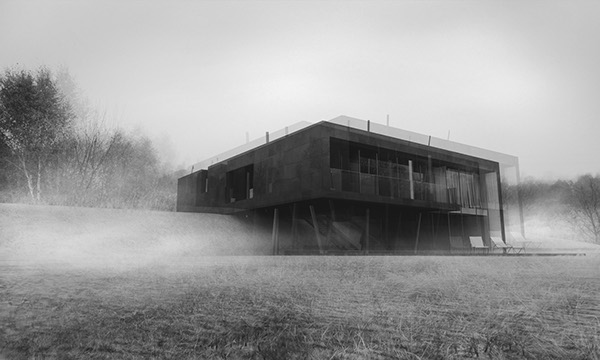
Find the location of a particular element. chair is located at coordinates (477, 236).